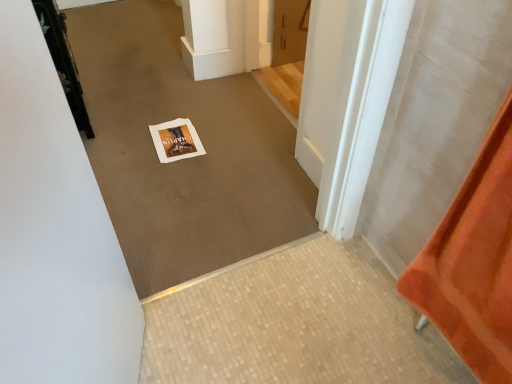
Question: Which direction should I rotate to look at matte wood door at upper center, the second door viewed from the left, — up or down?

Choices:
 (A) up
 (B) down

Answer: (A)

Question: Can you confirm if white paper at center is positioned to the left of white paper at center?

Choices:
 (A) no
 (B) yes

Answer: (A)

Question: Is white paper at center further to the viewer compared to white paper at center?

Choices:
 (A) no
 (B) yes

Answer: (A)

Question: Considering the relative sizes of white paper at center and white paper at center in the image provided, is white paper at center bigger than white paper at center?

Choices:
 (A) yes
 (B) no

Answer: (A)

Question: From a real-world perspective, does white paper at center stand above white paper at center?

Choices:
 (A) yes
 (B) no

Answer: (A)

Question: Can we say white paper at center lies outside white paper at center?

Choices:
 (A) no
 (B) yes

Answer: (B)

Question: Would you say white paper at center is part of white paper at center's contents?

Choices:
 (A) yes
 (B) no

Answer: (B)

Question: Does white paper at center have a greater height compared to white paper at center?

Choices:
 (A) yes
 (B) no

Answer: (B)

Question: Does white paper at center have a smaller size compared to white paper at center?

Choices:
 (A) no
 (B) yes

Answer: (B)

Question: Are white paper at center and white paper at center making contact?

Choices:
 (A) no
 (B) yes

Answer: (A)

Question: Considering the relative sizes of white paper at center and white paper at center in the image provided, is white paper at center wider than white paper at center?

Choices:
 (A) yes
 (B) no

Answer: (A)

Question: Considering the relative sizes of white paper at center and white paper at center in the image provided, is white paper at center shorter than white paper at center?

Choices:
 (A) yes
 (B) no

Answer: (A)

Question: Is white paper at center bigger than white paper at center?

Choices:
 (A) no
 (B) yes

Answer: (A)

Question: Is matte wood door at upper center, the second door viewed from the left, further to the viewer compared to white paper at center?

Choices:
 (A) yes
 (B) no

Answer: (A)